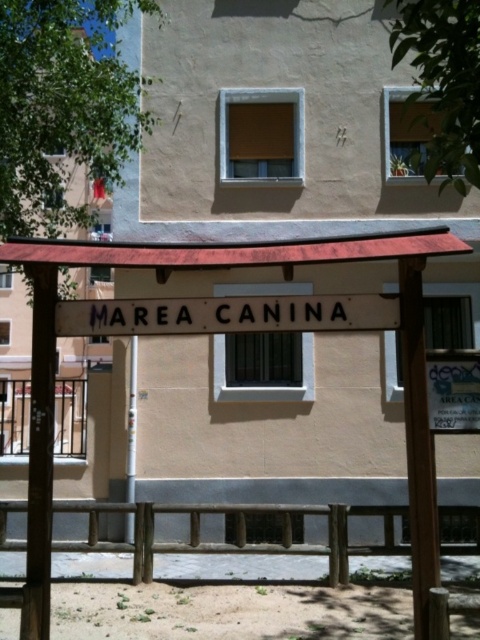
You are standing in front of the building and want to walk towards the white plastic pole at center. Is the wooden fence at lower center blocking your path?

The wooden fence at lower center is closer to the viewer than the white plastic pole at center, so it is blocking the path to the white plastic pole at center.

You are standing at the entrance of the building and want to walk to the wooden fence at lower center. Which direction should you turn to face the white plastic pole at center first?

To reach the wooden fence at lower center, you should turn to your right because the wooden fence at lower center is located to the right of the white plastic pole at center, so facing the pole first would mean turning right from the entrance.

In the scene shown: You are designing a layout for a garden and need to place a bench. The bench requires a space wider than the white plastic pole at center. Can the wooden fence at lower center provide enough space for the bench?

The wooden fence at lower center has a larger width than the white plastic pole at center, so it can provide enough space for the bench.